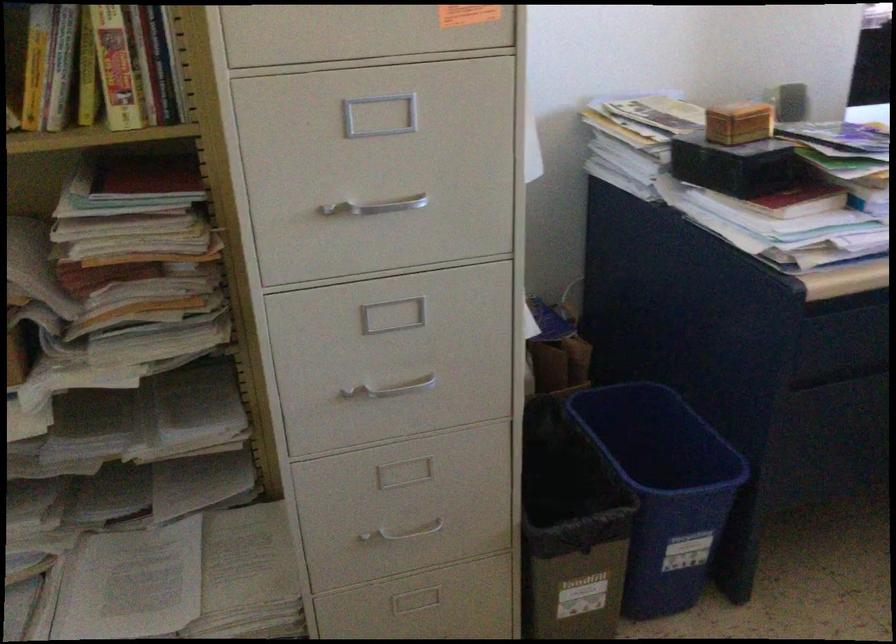
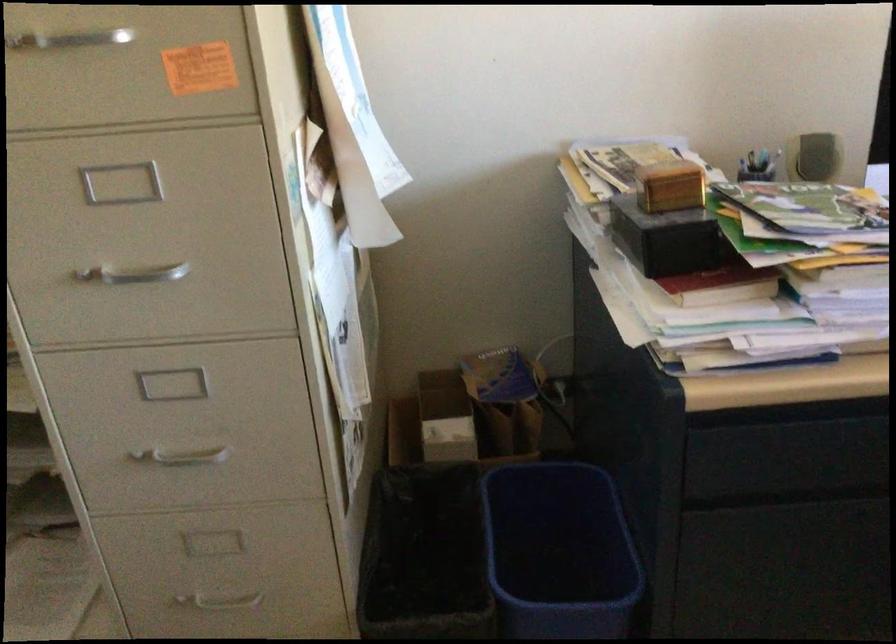
Where in the second image is the point corresponding to (757,164) from the first image?

(668, 239)